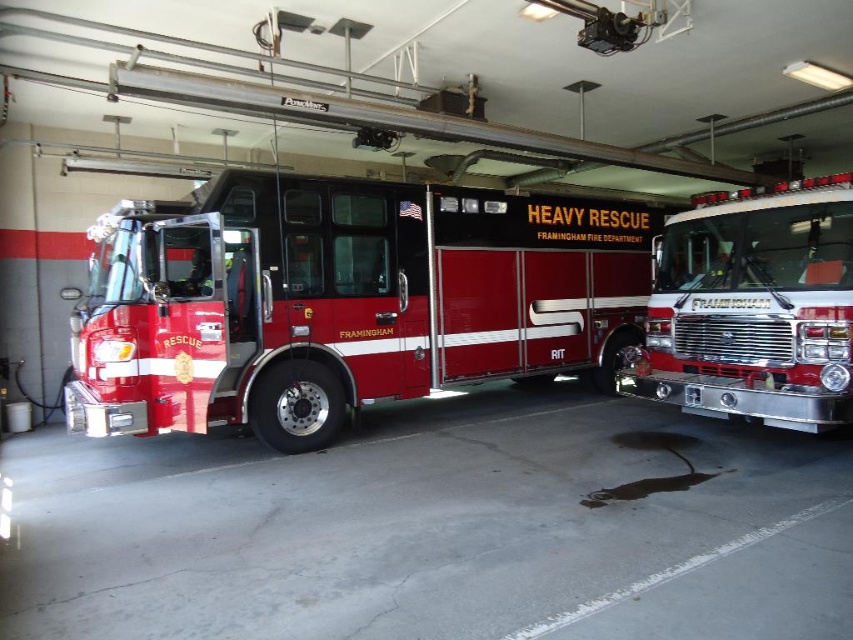
Does point (570, 280) come behind point (819, 300)?

Yes, point (570, 280) is behind point (819, 300).

Is shiny red fire truck at center further to camera compared to shiny chrome fire truck at right?

Yes, shiny red fire truck at center is behind shiny chrome fire truck at right.

Between point (526, 220) and point (699, 396), which one is positioned in front?

Point (699, 396) is more forward.

What are the coordinates of `shiny red fire truck at center` in the screenshot? It's located at (344, 300).